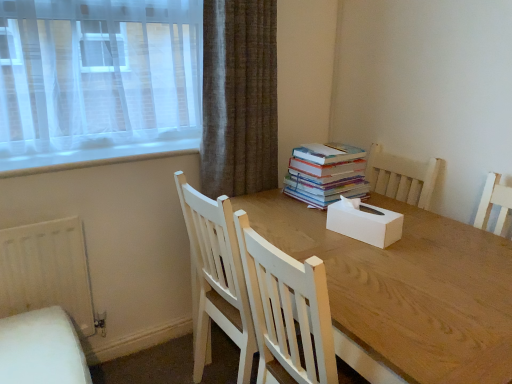
Question: Would you say multicolored paper book at center is inside or outside white cardboard tissue box at center?

Choices:
 (A) outside
 (B) inside

Answer: (A)

Question: From the image's perspective, is multicolored paper book at center positioned above or below white cardboard tissue box at center?

Choices:
 (A) below
 (B) above

Answer: (B)

Question: Which is nearer to the wooden table at center?

Choices:
 (A) white cardboard tissue box at center
 (B) multicolored paper book at center
 (C) white matte radiator at lower left

Answer: (A)

Question: Which object is the closest to the multicolored paper book at center?

Choices:
 (A) white matte radiator at lower left
 (B) wooden table at center
 (C) white cardboard tissue box at center

Answer: (C)